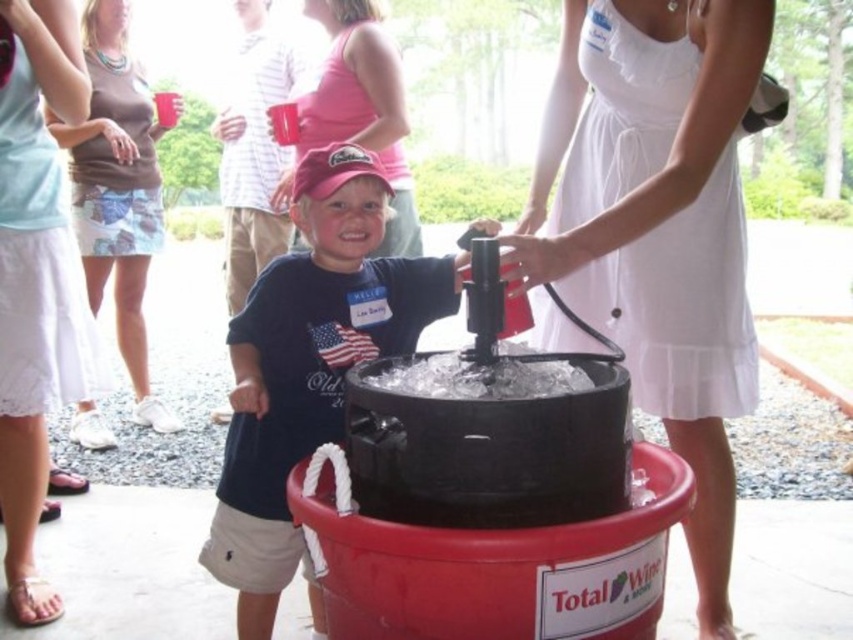
Which is more to the right, white cotton dress at center or brown cotton tank top at upper left?

white cotton dress at center is more to the right.

Does white cotton dress at center appear under brown cotton tank top at upper left?

Indeed, white cotton dress at center is positioned under brown cotton tank top at upper left.

Does point (619, 225) lie in front of point (137, 259)?

Yes, it is in front of point (137, 259).

The height and width of the screenshot is (640, 853). I want to click on white cotton dress at center, so click(x=654, y=202).

Can you confirm if white cotton dress at center is wider than matte black shirt at center?

In fact, white cotton dress at center might be narrower than matte black shirt at center.

Does point (709, 236) lie in front of point (280, 417)?

No, it is behind (280, 417).

Locate an element on the screen. The width and height of the screenshot is (853, 640). white cotton dress at center is located at coordinates tap(654, 202).

Does matte black shirt at center have a lesser width compared to white lace dress at upper left?

Incorrect, matte black shirt at center's width is not less than white lace dress at upper left's.

Is matte black shirt at center to the right of white lace dress at upper left from the viewer's perspective?

Correct, you'll find matte black shirt at center to the right of white lace dress at upper left.

The height and width of the screenshot is (640, 853). What are the coordinates of `matte black shirt at center` in the screenshot? It's located at (309, 365).